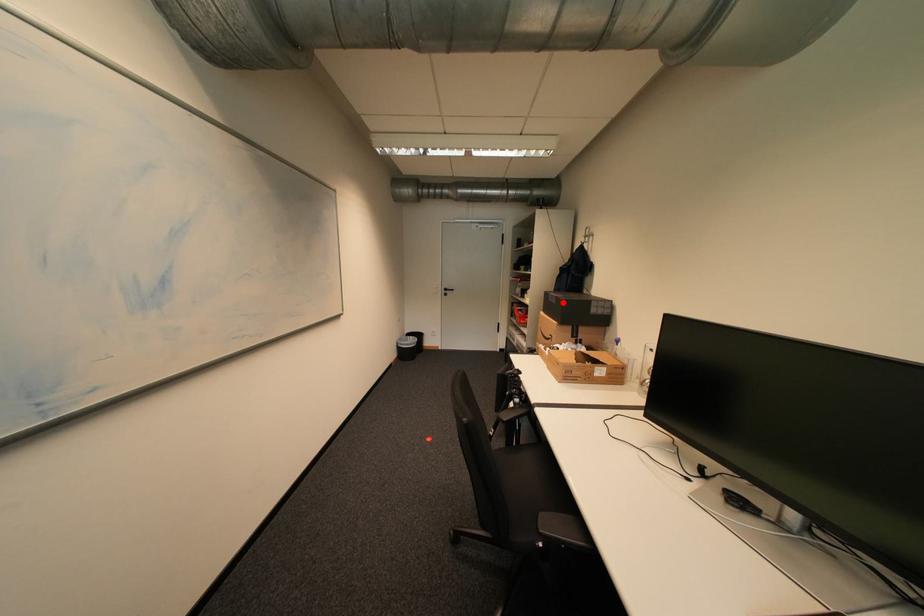
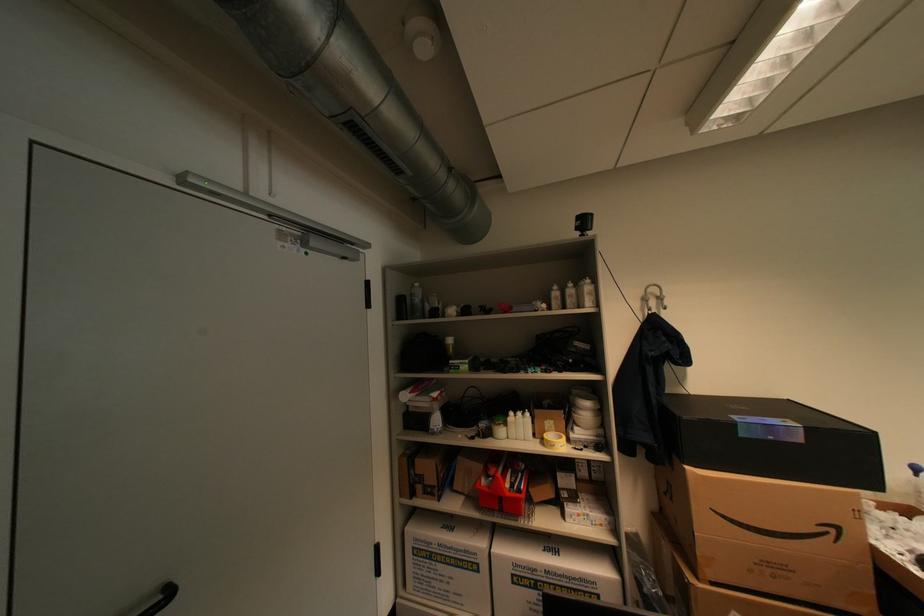
The point at the highlighted location is marked in the first image. Where is the corresponding point in the second image?

(808, 440)